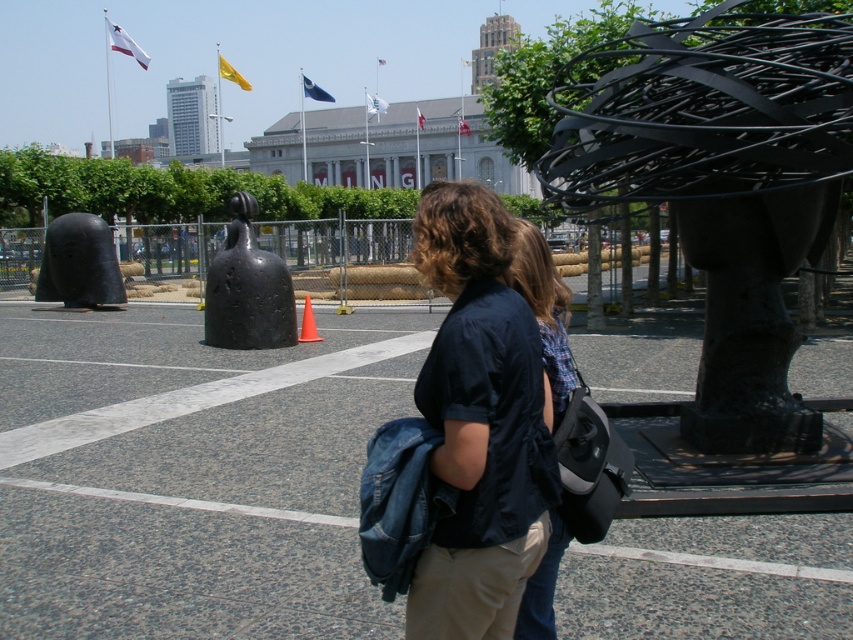
You are standing in the plaza looking at the sculpture. There are two points marked on the sculpture. Which point is closer to you, point (62, 531) or point (263, 317)?

Point (62, 531) is closer to you than point (263, 317).

You are standing at the origin point of the coordinate system in the image. You want to walk to the gray asphalt parking lot at center. Which direction should you walk to reach it?

The gray asphalt parking lot at center is located at coordinate point (192, 474), so you should walk towards the northeast direction to reach it.